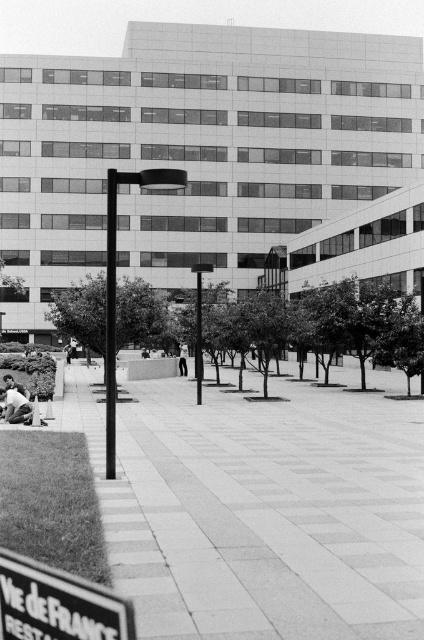
Question: Which of the following is the farthest from the observer?

Choices:
 (A) (21, 397)
 (B) (382, 484)

Answer: (A)

Question: Among these points, which one is nearest to the camera?

Choices:
 (A) (125, 621)
 (B) (351, 499)
 (C) (10, 406)

Answer: (A)

Question: Where is metallic street sign at lower left located in relation to light skin tone human at lower left in the image?

Choices:
 (A) right
 (B) left

Answer: (A)

Question: Among these objects, which one is farthest from the camera?

Choices:
 (A) smooth concrete pavement at center
 (B) light skin tone human at lower left

Answer: (B)

Question: Is metallic street sign at lower left wider than light skin tone human at lower left?

Choices:
 (A) yes
 (B) no

Answer: (B)

Question: Can you confirm if smooth concrete pavement at center is thinner than metallic street sign at lower left?

Choices:
 (A) yes
 (B) no

Answer: (B)